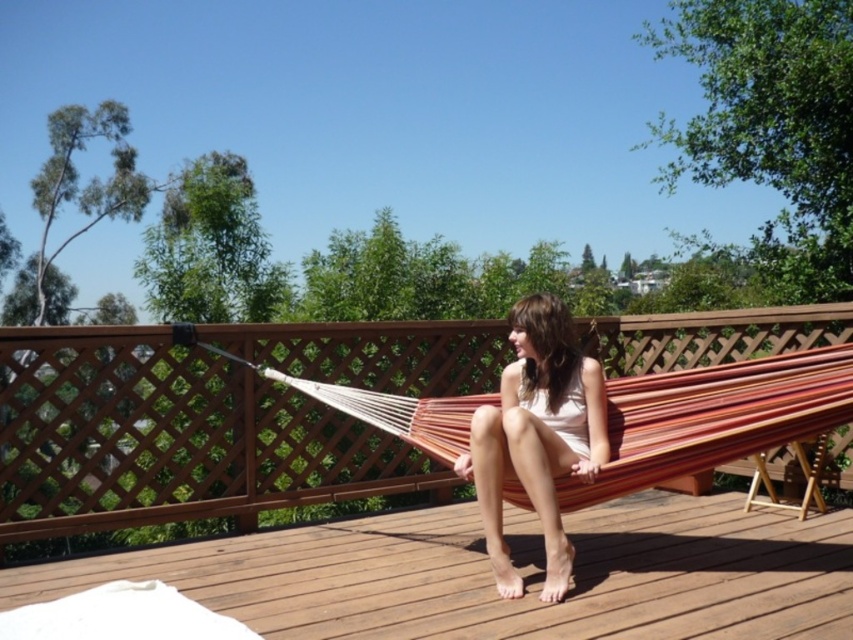
You are standing at a point 6 meters away from the wooden deck. If you walk towards the deck, will you reach the deck before reaching the point labeled as point (665,323)?

The distance between the viewer and point (665,323) is 5.87 meters. Since you are currently 6 meters away from the deck, you will reach the deck before reaching point (665,323) because the deck is closer.

You are a maintenance worker inspecting the wooden structures in the image. Which object is located above the other between the natural wood hammock at center and the wooden deck at center?

The natural wood hammock at center is positioned over the wooden deck at center, so the hammock is above the deck.